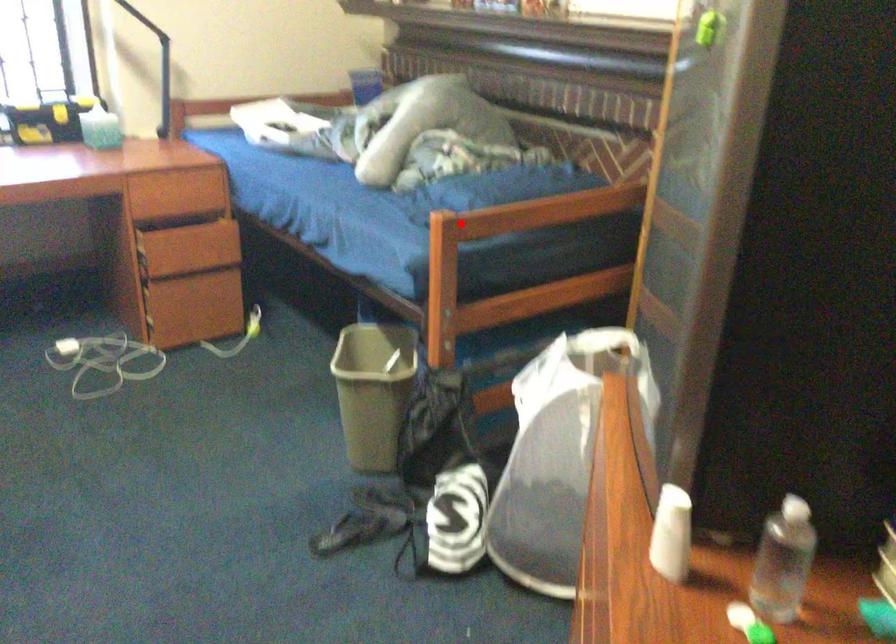
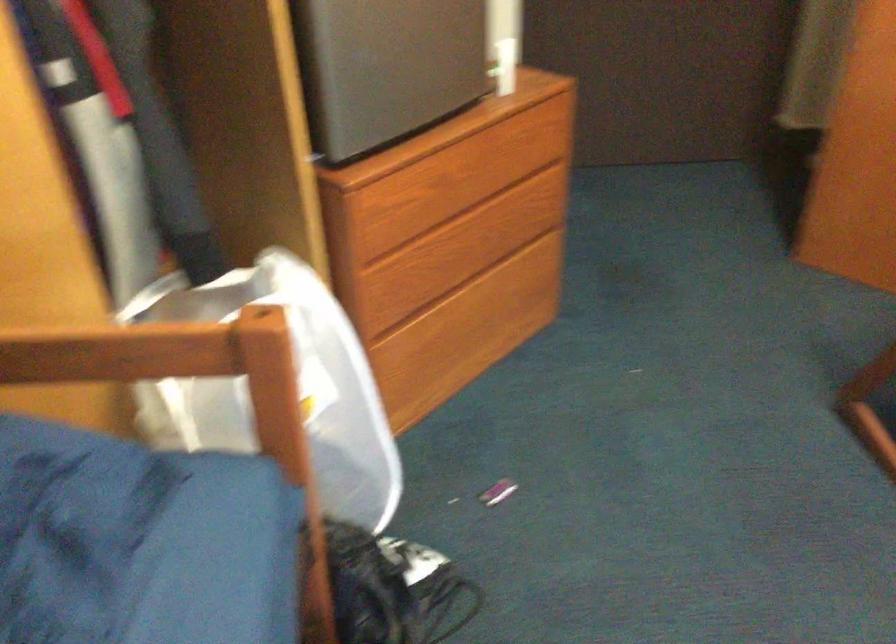
Question: I am providing you with two images of the same scene from different viewpoints. Image1 has a red point marked. In image2, the corresponding 3D location appears at what relative position? Reply with the corresponding letter.

Choices:
 (A) Closer
 (B) Farther

Answer: (A)